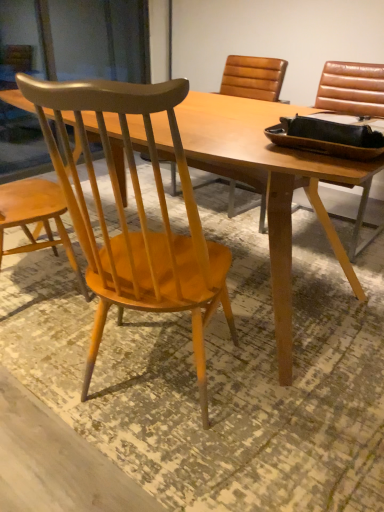
What are the coordinates of `vacant position to the left of light brown wood chair at left` in the screenshot? It's located at (44, 346).